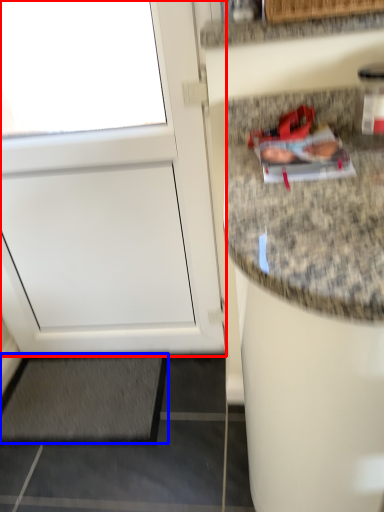
Question: Among these objects, which one is nearest to the camera, door (highlighted by a red box) or mat (highlighted by a blue box)?

Choices:
 (A) door
 (B) mat

Answer: (A)